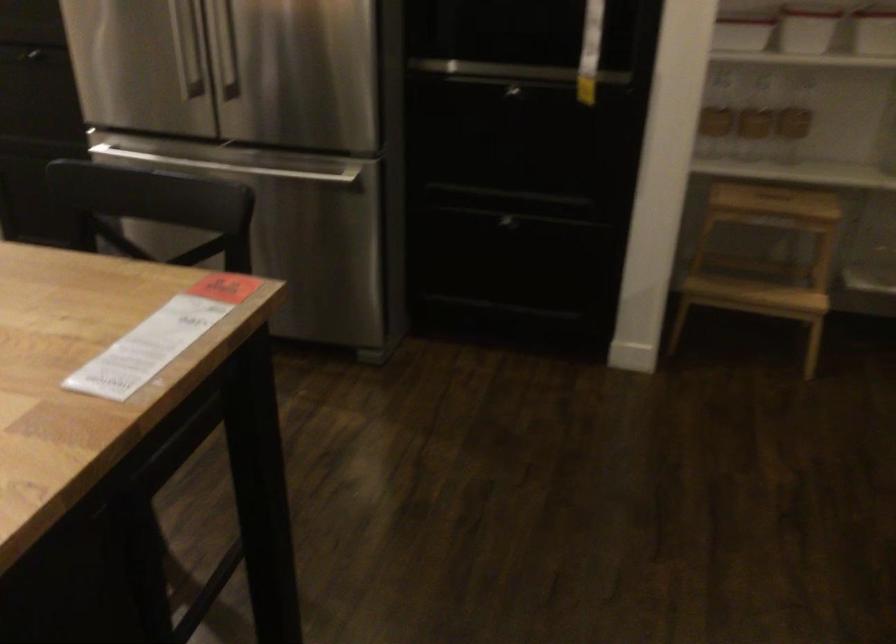
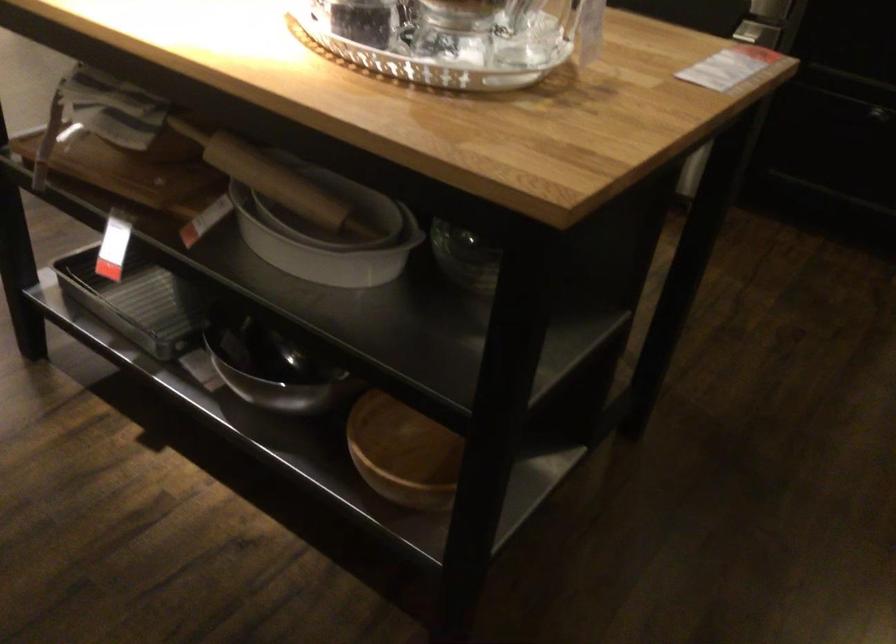
The images are taken continuously from a first-person perspective. In which direction are you moving?

The movement direction of the cameraman is left, backward.